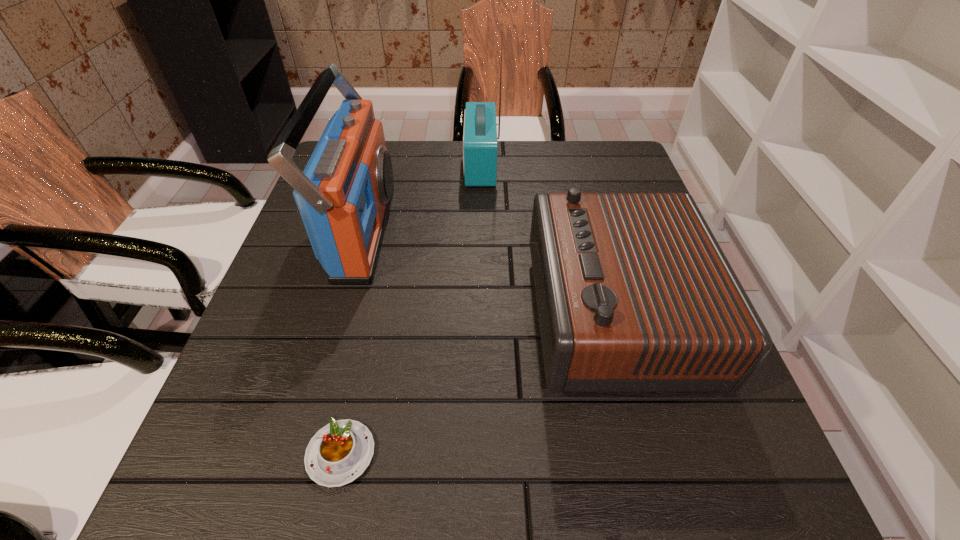
Locate an element on the screen. the second object from right to left is located at coordinates (479, 150).

Where is `the leftmost radio receiver`? The height and width of the screenshot is (540, 960). the leftmost radio receiver is located at coordinates (344, 194).

Where is `the rightmost object`? the rightmost object is located at coordinates (634, 294).

Identify the location of the rightmost radio receiver. (634, 294).

Identify the location of pudding. Image resolution: width=960 pixels, height=540 pixels. (340, 452).

You are a GUI agent. You are given a task and a screenshot of the screen. Output one action in this format:
    pyautogui.click(x=<x>, y=<y>)
    Task: Click on the shortest object
    The width and height of the screenshot is (960, 540).
    Given the screenshot: What is the action you would take?
    click(x=340, y=452)

At what (x,y) coordinates should I click in order to perform the action: click on free spot located 0.140m on the front panel of the second object from right to left. Please return your answer as a coordinate pair (x, y). Image resolution: width=960 pixels, height=540 pixels. Looking at the image, I should click on (412, 165).

Locate an element on the screen. The width and height of the screenshot is (960, 540). free space located 0.330m on the front panel of the second object from right to left is located at coordinates (343, 165).

Identify the location of blank space located 0.090m on the front panel of the second object from right to left. The height and width of the screenshot is (540, 960). (429, 165).

At what (x,y) coordinates should I click in order to perform the action: click on free space located on the front-facing side of the leftmost radio receiver. Please return your answer as a coordinate pair (x, y). Looking at the image, I should click on (519, 232).